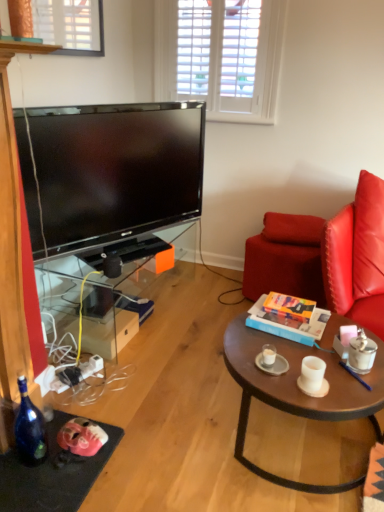
The image size is (384, 512). What are the coordinates of `vacant space in front of black plastic pen at center` in the screenshot? It's located at (360, 395).